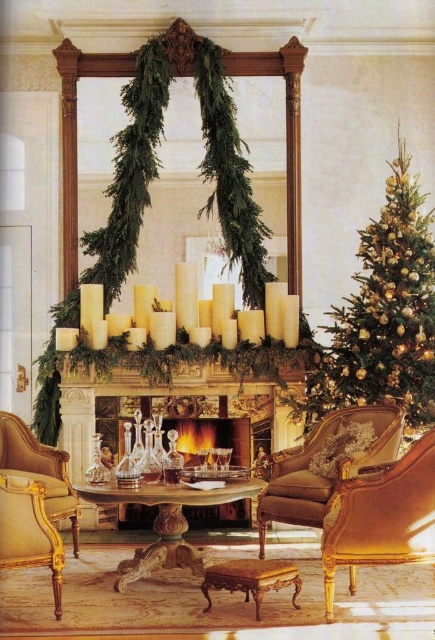
Question: Considering the real-world distances, which object is closest to the gold wood armchair at lower left?

Choices:
 (A) gold polished wood armchair at center
 (B) matte gold fireplace at center
 (C) gold glittering ornaments at right

Answer: (A)

Question: Which of the following is the farthest from the observer?

Choices:
 (A) (77, 497)
 (B) (194, 432)
 (C) (278, 484)

Answer: (B)

Question: Considering the relative positions of gold glittering ornaments at right and brown leather armchair at center in the image provided, where is gold glittering ornaments at right located with respect to brown leather armchair at center?

Choices:
 (A) below
 (B) above

Answer: (B)

Question: Can you confirm if gold polished wood armchair at center is thinner than matte gold fireplace at center?

Choices:
 (A) no
 (B) yes

Answer: (B)

Question: Is brown leather armchair at center below matte gold fireplace at center?

Choices:
 (A) yes
 (B) no

Answer: (A)

Question: Estimate the real-world distances between objects in this image. Which object is farther from the gold upholstered armchair at lower left?

Choices:
 (A) gold glittering ornaments at right
 (B) matte gold fireplace at center

Answer: (A)